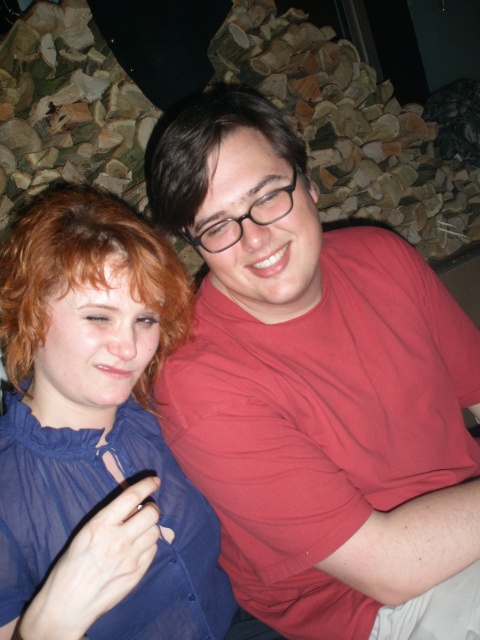
Question: Among these objects, which one is nearest to the camera?

Choices:
 (A) reddish brown curly hair at left
 (B) blue satin blouse at upper left

Answer: (B)

Question: Is reddish brown curly hair at left in front of dark brown hair at center?

Choices:
 (A) yes
 (B) no

Answer: (A)

Question: From the image, what is the correct spatial relationship of blue satin blouse at upper left in relation to reddish brown curly hair at left?

Choices:
 (A) above
 (B) below

Answer: (B)

Question: Which point appears farthest from the camera in this image?

Choices:
 (A) (334, 296)
 (B) (144, 237)
 (C) (57, 317)

Answer: (A)

Question: Can you confirm if blue satin blouse at upper left is positioned to the left of dark brown hair at center?

Choices:
 (A) no
 (B) yes

Answer: (B)

Question: Among these objects, which one is farthest from the camera?

Choices:
 (A) dark brown hair at center
 (B) matte red shirt at center

Answer: (A)